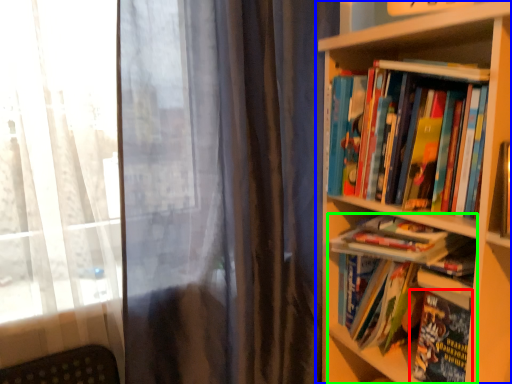
Question: Which object is the closest to the book (highlighted by a red box)? Choose among these: bookcase (highlighted by a blue box) or book (highlighted by a green box).

Choices:
 (A) bookcase
 (B) book

Answer: (B)